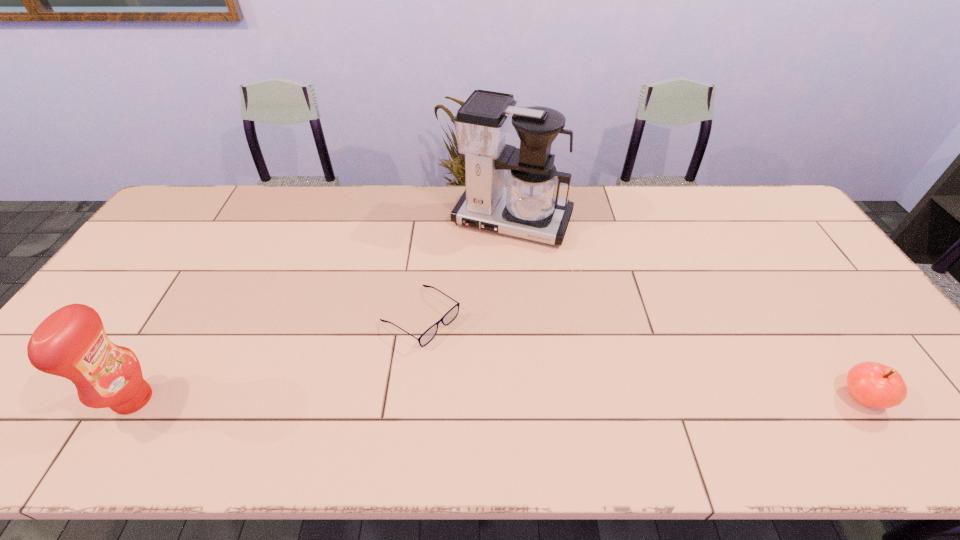
Image resolution: width=960 pixels, height=540 pixels. Identify the location of free spot between the third shortest object and the shortest object. click(x=277, y=358).

The width and height of the screenshot is (960, 540). I want to click on free space between the coffee maker and the second shortest object, so click(686, 309).

Where is `vacant area that lies between the apple and the farthest object`? vacant area that lies between the apple and the farthest object is located at coordinates (686, 309).

Where is `vacant area between the rightmost object and the coffee maker`? vacant area between the rightmost object and the coffee maker is located at coordinates (686, 309).

This screenshot has width=960, height=540. In order to click on vacant area between the third tallest object and the condiment in this screenshot , I will do `click(497, 399)`.

The height and width of the screenshot is (540, 960). I want to click on the third closest object to the second shortest object, so click(x=71, y=342).

Locate an element on the screen. Image resolution: width=960 pixels, height=540 pixels. the closest object relative to the apple is located at coordinates (529, 207).

Identify the location of vacant space that satisfies the following two spatial constraints: 1. on the back side of the tallest object; 2. on the right side of the second farthest object. (432, 221).

Where is `free space that satisfies the following two spatial constraints: 1. on the front side of the rightmost object; 2. on the right side of the coffee maker`? This screenshot has height=540, width=960. free space that satisfies the following two spatial constraints: 1. on the front side of the rightmost object; 2. on the right side of the coffee maker is located at coordinates (527, 397).